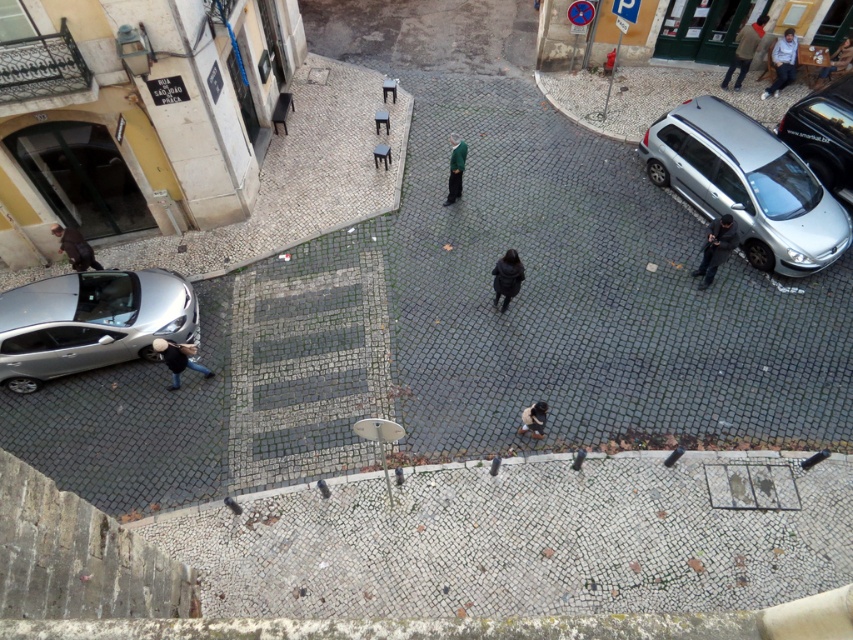
Question: Is dark gray fabric jacket at lower right closer to the viewer compared to dark brown leather jacket at upper right?

Choices:
 (A) no
 (B) yes

Answer: (B)

Question: Which of these objects is positioned farthest from the dark blue shirt at upper right?

Choices:
 (A) fluffy beige coat at center
 (B) dark blue jeans at lower left
 (C) dark brown leather jacket at upper right

Answer: (B)

Question: Does silver metallic car at lower left have a smaller size compared to fluffy beige coat at center?

Choices:
 (A) yes
 (B) no

Answer: (B)

Question: Which of these objects is positioned farthest from the dark blue shirt at upper right?

Choices:
 (A) dark blue jeans at lower left
 (B) light blue shirt at upper right
 (C) dark brown leather jacket at upper right

Answer: (A)

Question: Can you confirm if silver metallic hatchback at right is positioned to the right of dark gray fabric jacket at lower right?

Choices:
 (A) no
 (B) yes

Answer: (B)

Question: Among these objects, which one is farthest from the camera?

Choices:
 (A) silver metallic car at upper right
 (B) dark brown leather jacket at left
 (C) dark gray fabric jacket at lower right

Answer: (A)